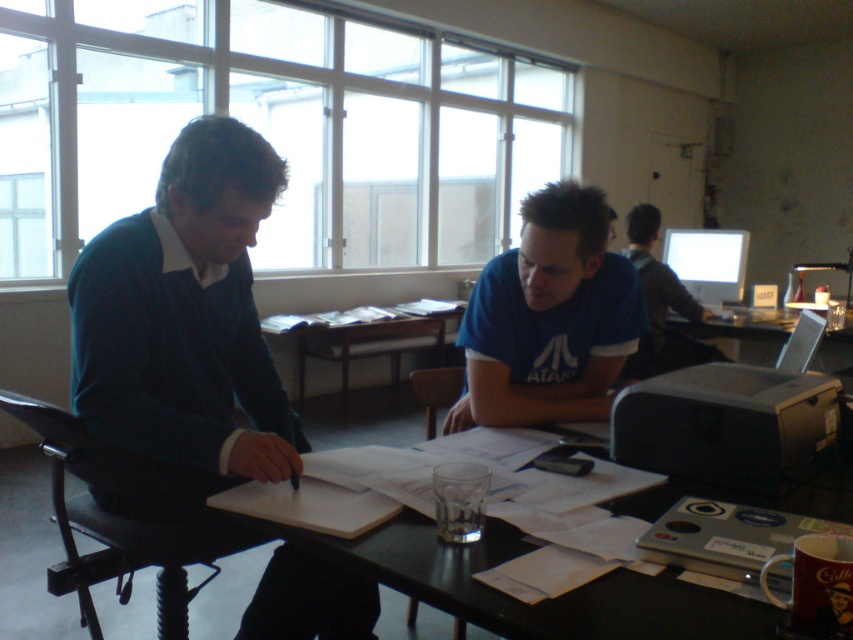
Question: Which point is closer to the camera taking this photo?

Choices:
 (A) (671, 589)
 (B) (463, 404)
 (C) (189, 260)
 (D) (720, 316)

Answer: (A)

Question: Which of the following is the closest to the observer?

Choices:
 (A) (757, 349)
 (B) (409, 339)
 (C) (181, 248)

Answer: (C)

Question: Can you confirm if dark blue sweater at left is thinner than blue cotton shirt at center?

Choices:
 (A) yes
 (B) no

Answer: (B)

Question: Which object is positioned farthest from the metallic silver laptop at center?

Choices:
 (A) dark blue sweater at left
 (B) blue cotton shirt at center

Answer: (A)

Question: Considering the relative positions of blue cotton shirt at center and metallic silver laptop at center in the image provided, where is blue cotton shirt at center located with respect to metallic silver laptop at center?

Choices:
 (A) below
 (B) above

Answer: (A)

Question: Is black plastic table at center below wooden at center?

Choices:
 (A) no
 (B) yes

Answer: (B)